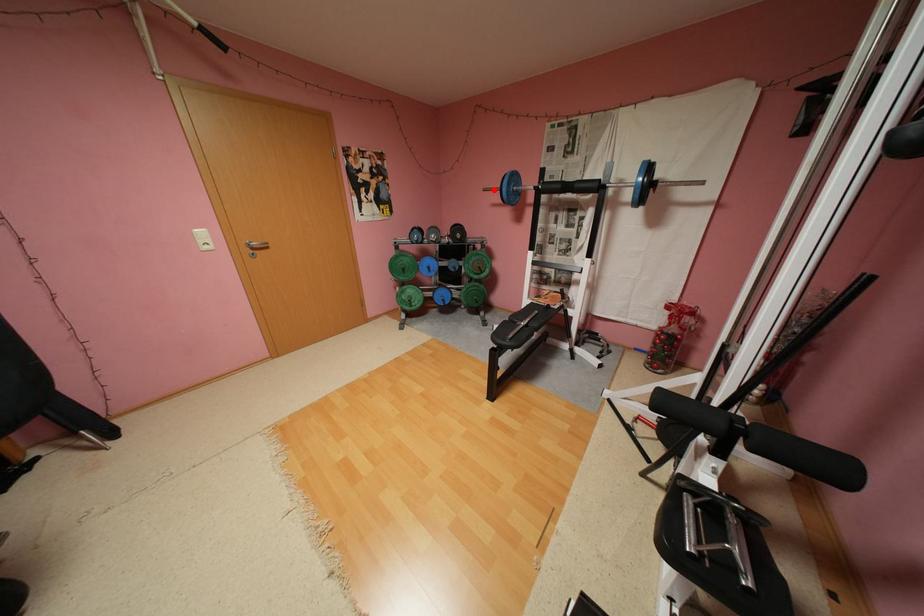
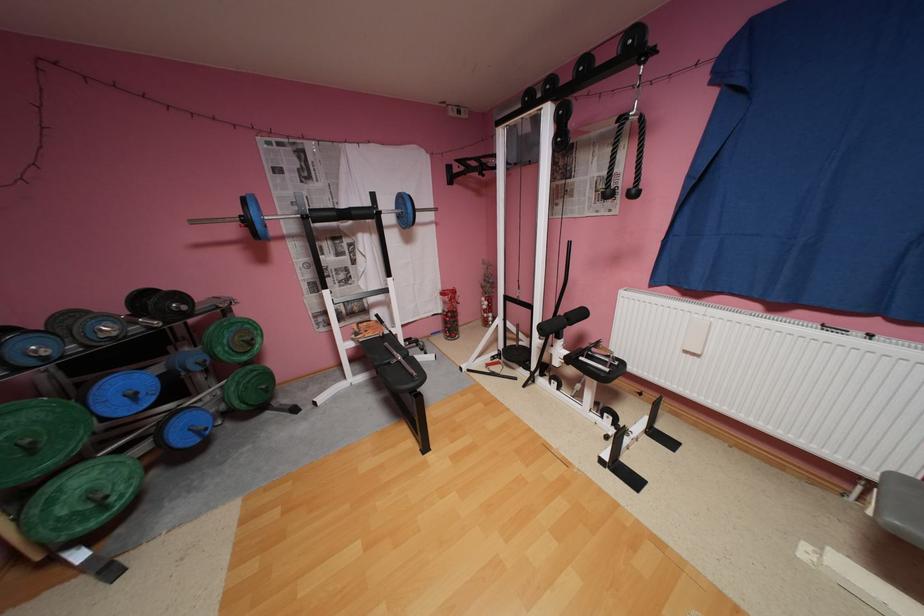
Where in the second image is the point corresponding to the highlighted location from the first image?

(202, 223)